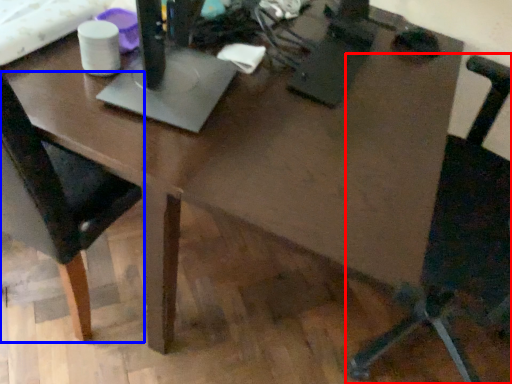
Question: Which point is further to the camera, chair (highlighted by a red box) or chair (highlighted by a blue box)?

Choices:
 (A) chair
 (B) chair

Answer: (B)